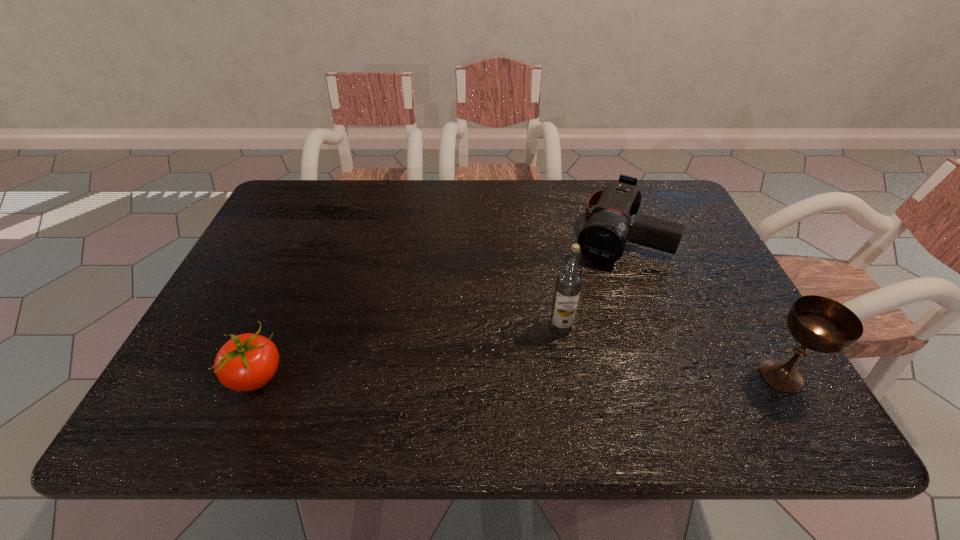
You are a GUI agent. You are given a task and a screenshot of the screen. Output one action in this format:
    pyautogui.click(x=<x>, y=<y>)
    Task: Click on the leftmost object
    This screenshot has width=960, height=540.
    Given the screenshot: What is the action you would take?
    pyautogui.click(x=247, y=362)

You are a GUI agent. You are given a task and a screenshot of the screen. Output one action in this format:
    pyautogui.click(x=<x>, y=<y>)
    Task: Click on the rightmost object
    Image resolution: width=960 pixels, height=540 pixels.
    Given the screenshot: What is the action you would take?
    821,324

The width and height of the screenshot is (960, 540). Identify the location of the third shortest object. (821, 324).

The image size is (960, 540). Find the location of `camcorder`. camcorder is located at coordinates (603, 239).

Identify the location of the farthest object. The image size is (960, 540). (603, 239).

The width and height of the screenshot is (960, 540). Identify the location of the third object from right to left. (568, 285).

Find the location of a particular element. This screenshot has height=540, width=960. the tallest object is located at coordinates [568, 285].

The image size is (960, 540). What are the coordinates of `free space located on the back of the tomato` in the screenshot? It's located at (301, 273).

Locate an element on the screen. vacant space situated on the left of the third shortest object is located at coordinates (598, 375).

Locate an element on the screen. The image size is (960, 540). free space located on the lens of the second object from right to left is located at coordinates (590, 296).